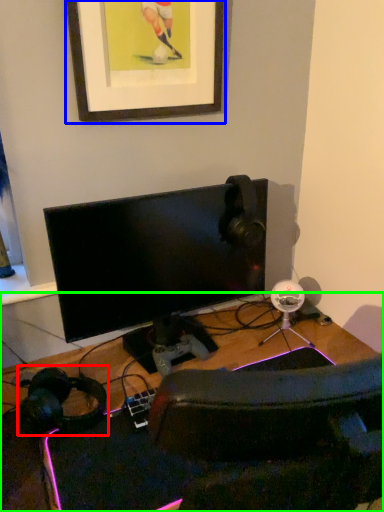
Question: Which is farther away from headphones (highlighted by a red box)? picture frame (highlighted by a blue box) or desk (highlighted by a green box)?

Choices:
 (A) picture frame
 (B) desk

Answer: (A)